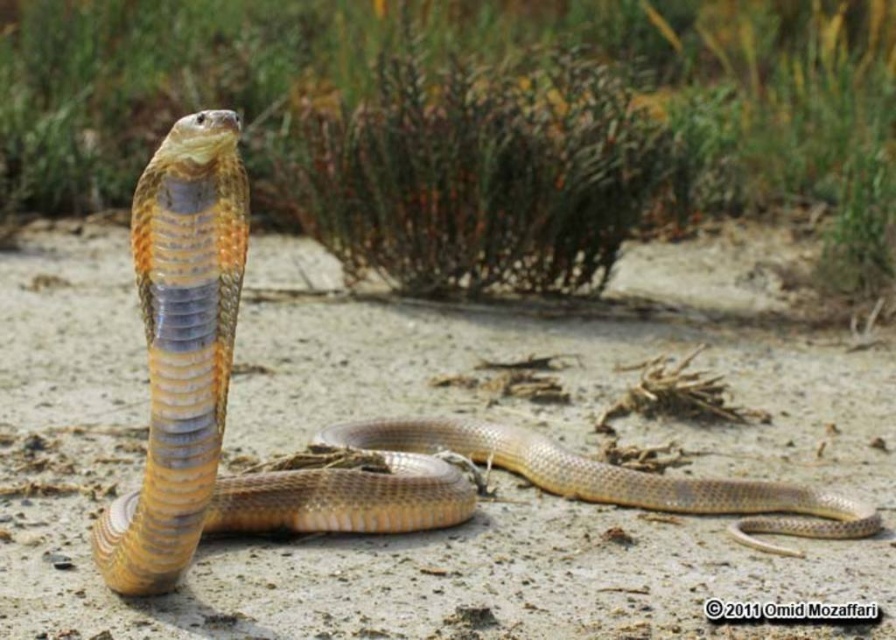
You are an archaeologist examining the scene. You need to place a 10cm x 10cm square marker on the smooth sand at center. Where should you place it to ensure it is exactly at the center of the sand?

The smooth sand at center is located at point (436, 416), so you should place the marker at those coordinates to ensure it is exactly at the center of the sand.